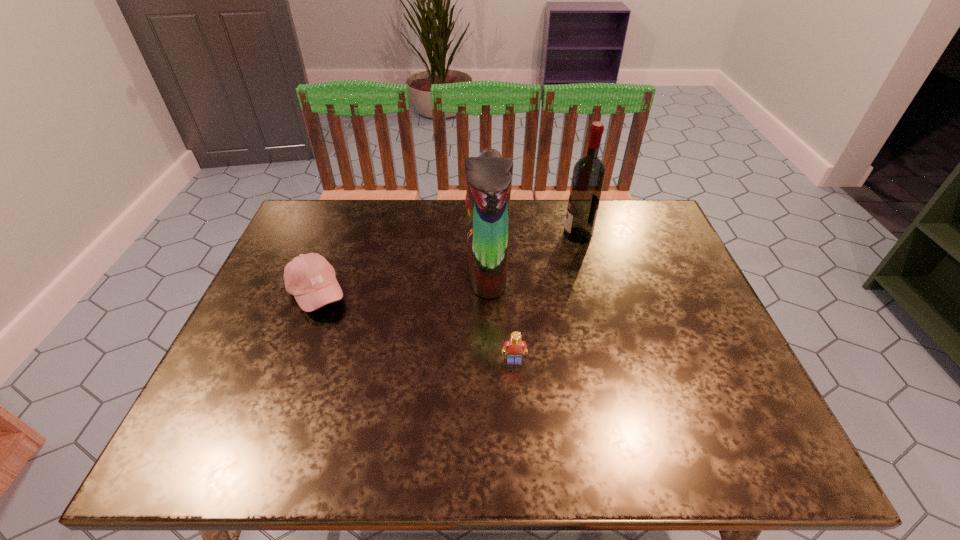
Locate an element on the screen. the third closest object to the rightmost object is located at coordinates (310, 278).

This screenshot has width=960, height=540. What are the coordinates of `object that can be found as the third closest to the alcohol` in the screenshot? It's located at (310, 278).